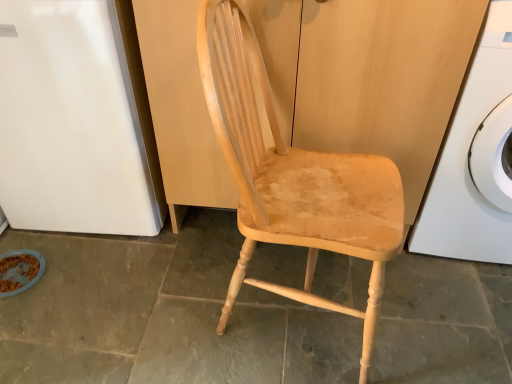
Image resolution: width=512 pixels, height=384 pixels. What are the coordinates of `free space to the left of natural wood chair at center` in the screenshot? It's located at (162, 310).